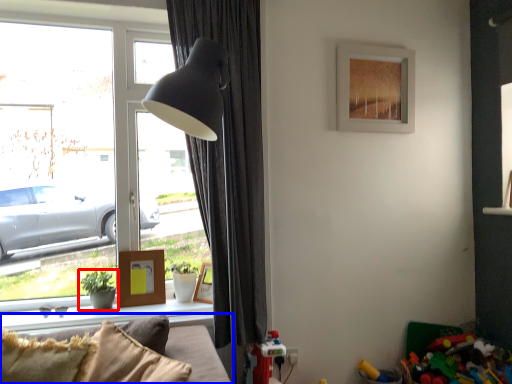
Question: Among these objects, which one is nearest to the camera, houseplant (highlighted by a red box) or studio couch (highlighted by a blue box)?

Choices:
 (A) houseplant
 (B) studio couch

Answer: (B)